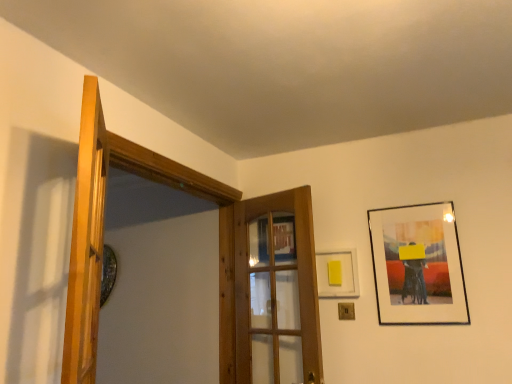
Measure the distance between point (70,349) and camera.

They are 36.42 inches apart.

Identify the location of yellow matte picture frame at upper right, the first picture frame positioned from the left. (339, 273).

In the scene shown: What's the angular difference between matte black picture frame at upper right, the second picture frame from the left, and yellow matte picture frame at upper right, the first picture frame positioned from the left,'s facing directions?

The angle between the facing direction of matte black picture frame at upper right, the second picture frame from the left, and the facing direction of yellow matte picture frame at upper right, the first picture frame positioned from the left, is 1.26 degrees.

Considering the relative sizes of matte black picture frame at upper right, the second picture frame from the left, and yellow matte picture frame at upper right, positioned as the 2th picture frame in right-to-left order, in the image provided, is matte black picture frame at upper right, the second picture frame from the left, thinner than yellow matte picture frame at upper right, positioned as the 2th picture frame in right-to-left order,?

No.

Does matte black picture frame at upper right, which is the first picture frame in right-to-left order, have a smaller size compared to yellow matte picture frame at upper right, positioned as the 2th picture frame in right-to-left order?

Actually, matte black picture frame at upper right, which is the first picture frame in right-to-left order, might be larger than yellow matte picture frame at upper right, positioned as the 2th picture frame in right-to-left order.

From the picture: Which object is further away from the camera, matte black picture frame at upper right, which is the first picture frame in right-to-left order, or yellow matte picture frame at upper right, positioned as the 2th picture frame in right-to-left order?

yellow matte picture frame at upper right, positioned as the 2th picture frame in right-to-left order, is behind.

In the scene shown: From the image's perspective, would you say wooden door at left, which is the 1th door in front-to-back order, is positioned over yellow matte picture frame at upper right, the first picture frame positioned from the left?

Yes, from the image's perspective, wooden door at left, which is the 1th door in front-to-back order, is on top of yellow matte picture frame at upper right, the first picture frame positioned from the left.

Is wooden door at left, which is the first door in left-to-right order, bigger or smaller than yellow matte picture frame at upper right, the first picture frame positioned from the left?

Clearly, wooden door at left, which is the first door in left-to-right order, is larger in size than yellow matte picture frame at upper right, the first picture frame positioned from the left.

Could you tell me if wooden door at left, the second door viewed from the back, is facing yellow matte picture frame at upper right, the first picture frame positioned from the left?

No, wooden door at left, the second door viewed from the back, does not turn towards yellow matte picture frame at upper right, the first picture frame positioned from the left.

Between wooden door at left, the second door from the right, and wooden door at center, acting as the 1th door starting from the right, which one appears on the right side from the viewer's perspective?

Positioned to the right is wooden door at center, acting as the 1th door starting from the right.

Is wooden door at left, the second door from the right, located outside wooden door at center, arranged as the 2th door when viewed from the front?

Yes, wooden door at left, the second door from the right, is located beyond the bounds of wooden door at center, arranged as the 2th door when viewed from the front.

How many degrees apart are the facing directions of wooden door at left, which is the 1th door in front-to-back order, and wooden door at center, which is the 2th door in left-to-right order?

wooden door at left, which is the 1th door in front-to-back order, and wooden door at center, which is the 2th door in left-to-right order, are facing 148 degrees away from each other.

In the scene shown: From a real-world perspective, between wooden door at left, which is the 1th door in front-to-back order, and wooden door at center, acting as the 1th door starting from the right, who is vertically lower?

From a 3D spatial view, wooden door at center, acting as the 1th door starting from the right, is below.

Locate an element on the screen. This screenshot has width=512, height=384. door above the yellow matte picture frame at upper right, the first picture frame positioned from the left (from the image's perspective) is located at coordinates (86, 242).

Is yellow matte picture frame at upper right, positioned as the 2th picture frame in right-to-left order, bigger than wooden door at left, which is the 1th door in front-to-back order?

Incorrect, yellow matte picture frame at upper right, positioned as the 2th picture frame in right-to-left order, is not larger than wooden door at left, which is the 1th door in front-to-back order.

Which is behind, point (320, 263) or point (88, 78)?

Point (320, 263)

Could you measure the distance between yellow matte picture frame at upper right, positioned as the 2th picture frame in right-to-left order, and wooden door at left, which is the first door in left-to-right order?

yellow matte picture frame at upper right, positioned as the 2th picture frame in right-to-left order, is 1.42 meters from wooden door at left, which is the first door in left-to-right order.

Considering the sizes of objects wooden door at left, the second door from the right, and matte black picture frame at upper right, the second picture frame from the left, in the image provided, who is smaller, wooden door at left, the second door from the right, or matte black picture frame at upper right, the second picture frame from the left,?

matte black picture frame at upper right, the second picture frame from the left, is smaller.

How different are the orientations of wooden door at left, the second door viewed from the back, and matte black picture frame at upper right, which is the first picture frame in right-to-left order, in degrees?

129 degrees.

Which of these two, wooden door at left, which is the 1th door in front-to-back order, or matte black picture frame at upper right, the second picture frame from the left, stands shorter?

With less height is matte black picture frame at upper right, the second picture frame from the left.

Would you say matte black picture frame at upper right, which is the first picture frame in right-to-left order, is part of wooden door at left, which is the 1th door in front-to-back order,'s contents?

No, matte black picture frame at upper right, which is the first picture frame in right-to-left order, is located outside of wooden door at left, which is the 1th door in front-to-back order.

Who is smaller, wooden door at center, which is the first door from back to front, or yellow matte picture frame at upper right, positioned as the 2th picture frame in right-to-left order?

yellow matte picture frame at upper right, positioned as the 2th picture frame in right-to-left order.

How many degrees apart are the facing directions of wooden door at center, arranged as the 2th door when viewed from the front, and yellow matte picture frame at upper right, positioned as the 2th picture frame in right-to-left order?

18.3 degrees separate the facing orientations of wooden door at center, arranged as the 2th door when viewed from the front, and yellow matte picture frame at upper right, positioned as the 2th picture frame in right-to-left order.

Is wooden door at center, arranged as the 2th door when viewed from the front, oriented towards yellow matte picture frame at upper right, the first picture frame positioned from the left?

No, wooden door at center, arranged as the 2th door when viewed from the front, is not aimed at yellow matte picture frame at upper right, the first picture frame positioned from the left.

From the image's perspective, which is above, wooden door at center, which is the 2th door in left-to-right order, or yellow matte picture frame at upper right, the first picture frame positioned from the left?

yellow matte picture frame at upper right, the first picture frame positioned from the left.

Considering the relative sizes of matte black picture frame at upper right, which is the first picture frame in right-to-left order, and wooden door at left, which is the 1th door in front-to-back order, in the image provided, is matte black picture frame at upper right, which is the first picture frame in right-to-left order, smaller than wooden door at left, which is the 1th door in front-to-back order,?

Yes, matte black picture frame at upper right, which is the first picture frame in right-to-left order, is smaller than wooden door at left, which is the 1th door in front-to-back order.

Is matte black picture frame at upper right, which is the first picture frame in right-to-left order, far from wooden door at left, which is the first door in left-to-right order?

Yes, matte black picture frame at upper right, which is the first picture frame in right-to-left order, is far from wooden door at left, which is the first door in left-to-right order.

Can you confirm if matte black picture frame at upper right, the second picture frame from the left, is thinner than wooden door at left, the second door viewed from the back?

Correct, the width of matte black picture frame at upper right, the second picture frame from the left, is less than that of wooden door at left, the second door viewed from the back.

From the image's perspective, who appears lower, matte black picture frame at upper right, the second picture frame from the left, or wooden door at left, which is the first door in left-to-right order?

matte black picture frame at upper right, the second picture frame from the left, appears lower in the image.

Identify the location of picture frame on the right of yellow matte picture frame at upper right, positioned as the 2th picture frame in right-to-left order. (418, 265).

At what (x,y) coordinates should I click in order to perform the action: click on door above the yellow matte picture frame at upper right, the first picture frame positioned from the left (from the image's perspective). Please return your answer as a coordinate pair (x, y). Image resolution: width=512 pixels, height=384 pixels. Looking at the image, I should click on point(86,242).

Which object lies nearer to the anchor point wooden door at left, which is the first door in left-to-right order, wooden door at center, which is the first door from back to front, or yellow matte picture frame at upper right, the first picture frame positioned from the left?

wooden door at center, which is the first door from back to front.

When comparing their distances from matte black picture frame at upper right, which is the first picture frame in right-to-left order, does wooden door at center, acting as the 1th door starting from the right, or wooden door at left, the second door viewed from the back, seem closer?

Based on the image, wooden door at center, acting as the 1th door starting from the right, appears to be nearer to matte black picture frame at upper right, which is the first picture frame in right-to-left order.

Looking at the image, which one is located further to wooden door at center, which is the first door from back to front, wooden door at left, the second door from the right, or matte black picture frame at upper right, which is the first picture frame in right-to-left order?

wooden door at left, the second door from the right, lies further to wooden door at center, which is the first door from back to front, than the other object.

Based on their spatial positions, is yellow matte picture frame at upper right, the first picture frame positioned from the left, or wooden door at left, the second door viewed from the back, further from wooden door at center, which is the 2th door in left-to-right order?

Based on the image, wooden door at left, the second door viewed from the back, appears to be further to wooden door at center, which is the 2th door in left-to-right order.

Which object lies further to the anchor point matte black picture frame at upper right, the second picture frame from the left, wooden door at center, which is the first door from back to front, or yellow matte picture frame at upper right, positioned as the 2th picture frame in right-to-left order?

wooden door at center, which is the first door from back to front, is positioned further to the anchor matte black picture frame at upper right, the second picture frame from the left.

From the image, which object appears to be farther from yellow matte picture frame at upper right, the first picture frame positioned from the left, wooden door at center, acting as the 1th door starting from the right, or matte black picture frame at upper right, which is the first picture frame in right-to-left order?

wooden door at center, acting as the 1th door starting from the right, lies further to yellow matte picture frame at upper right, the first picture frame positioned from the left, than the other object.

Estimate the real-world distances between objects in this image. Which object is closer to wooden door at left, which is the first door in left-to-right order, matte black picture frame at upper right, which is the first picture frame in right-to-left order, or yellow matte picture frame at upper right, the first picture frame positioned from the left?

yellow matte picture frame at upper right, the first picture frame positioned from the left, is closer to wooden door at left, which is the first door in left-to-right order.

Based on the photo, which object lies nearer to the anchor point matte black picture frame at upper right, the second picture frame from the left, wooden door at left, the second door from the right, or wooden door at center, acting as the 1th door starting from the right?

wooden door at center, acting as the 1th door starting from the right, is positioned closer to the anchor matte black picture frame at upper right, the second picture frame from the left.

You are a GUI agent. You are given a task and a screenshot of the screen. Output one action in this format:
    pyautogui.click(x=<x>, y=<y>)
    Task: Click on the picture frame between wooden door at left, which is the first door in left-to-right order, and yellow matte picture frame at upper right, the first picture frame positioned from the left, in the front-back direction
    This screenshot has width=512, height=384.
    Given the screenshot: What is the action you would take?
    pyautogui.click(x=418, y=265)

At what (x,y) coordinates should I click in order to perform the action: click on door situated between wooden door at left, the second door from the right, and matte black picture frame at upper right, the second picture frame from the left, from left to right. Please return your answer as a coordinate pair (x, y). This screenshot has height=384, width=512. Looking at the image, I should click on (276, 284).

Locate an element on the screen. picture frame between wooden door at center, which is the first door from back to front, and matte black picture frame at upper right, which is the first picture frame in right-to-left order, from left to right is located at coordinates (339, 273).

The height and width of the screenshot is (384, 512). Find the location of `door located between wooden door at left, which is the 1th door in front-to-back order, and yellow matte picture frame at upper right, positioned as the 2th picture frame in right-to-left order, in the depth direction`. door located between wooden door at left, which is the 1th door in front-to-back order, and yellow matte picture frame at upper right, positioned as the 2th picture frame in right-to-left order, in the depth direction is located at coordinates (276, 284).